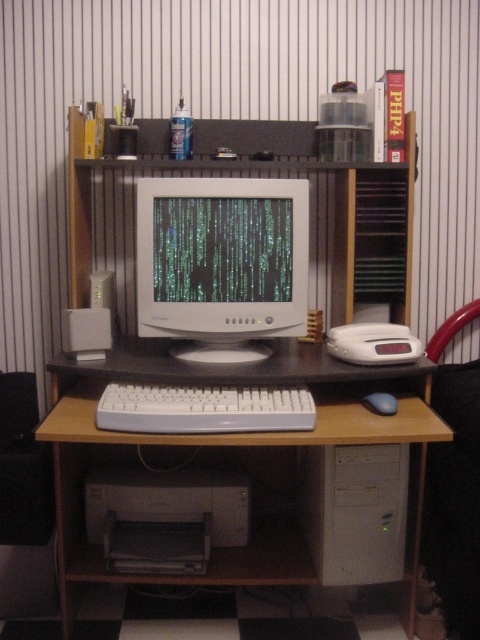
Is white plastic computer desk at center to the right of white glossy monitor at center from the viewer's perspective?

Correct, you'll find white plastic computer desk at center to the right of white glossy monitor at center.

Which is below, white plastic computer desk at center or white glossy monitor at center?

Positioned lower is white plastic computer desk at center.

Which is in front, point (251, 576) or point (303, 205)?

Positioned in front is point (303, 205).

This screenshot has width=480, height=640. What are the coordinates of `white plastic computer desk at center` in the screenshot? It's located at click(255, 520).

Does white glossy monitor at center come behind white plastic computer tower at lower center?

That is True.

Is white glossy monitor at center closer to camera compared to white plastic computer tower at lower center?

No, white glossy monitor at center is behind white plastic computer tower at lower center.

Is point (294, 188) positioned before point (351, 456)?

That is False.

You are a GUI agent. You are given a task and a screenshot of the screen. Output one action in this format:
    pyautogui.click(x=<x>, y=<y>)
    Task: Click on the white glossy monitor at center
    The image size is (480, 640).
    Given the screenshot: What is the action you would take?
    pyautogui.click(x=222, y=262)

Who is taller, white plastic computer desk at center or black matte mouse at lower center?

Standing taller between the two is white plastic computer desk at center.

Is white plastic computer desk at center positioned before black matte mouse at lower center?

Yes, white plastic computer desk at center is in front of black matte mouse at lower center.

Measure the distance between white plastic computer desk at center and camera.

1.47 meters

This screenshot has height=640, width=480. I want to click on white plastic computer desk at center, so click(255, 520).